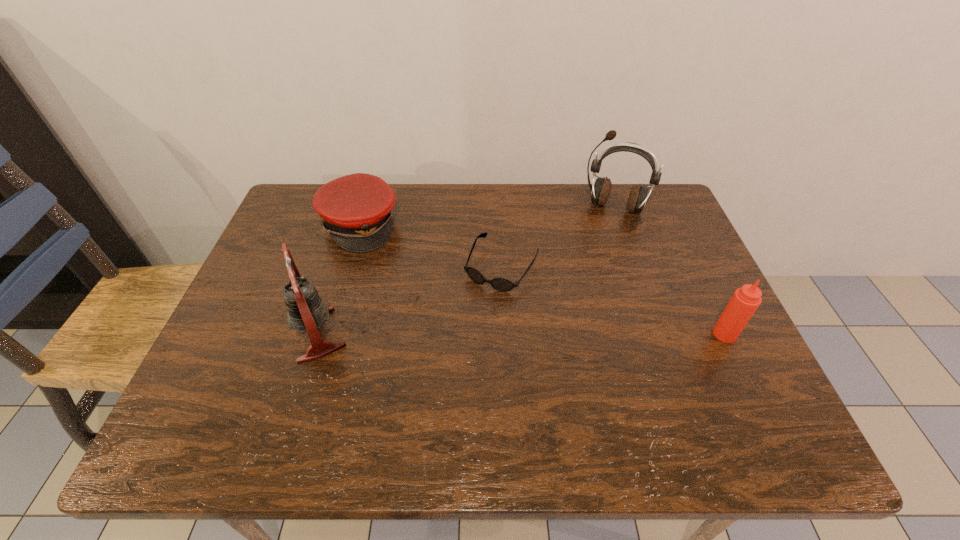
The height and width of the screenshot is (540, 960). Identify the location of bell present at the left edge. (306, 311).

The image size is (960, 540). In order to click on cap that is at the left edge in this screenshot , I will do `click(357, 209)`.

Locate an element on the screen. The width and height of the screenshot is (960, 540). Tabasco sauce present at the right edge is located at coordinates (745, 301).

You are a GUI agent. You are given a task and a screenshot of the screen. Output one action in this format:
    pyautogui.click(x=<x>, y=<y>)
    Task: Click on the earphone that is positioned at the right edge
    
    Given the screenshot: What is the action you would take?
    pyautogui.click(x=600, y=191)

Find the location of a particular element. The width and height of the screenshot is (960, 540). object located at the far left corner is located at coordinates (357, 209).

Identify the location of object that is at the far right corner. Image resolution: width=960 pixels, height=540 pixels. (600, 191).

This screenshot has width=960, height=540. In order to click on free space at the far edge in this screenshot , I will do `click(476, 219)`.

Where is `vacant space at the near edge`? Image resolution: width=960 pixels, height=540 pixels. vacant space at the near edge is located at coordinates (544, 376).

This screenshot has width=960, height=540. Find the location of `vacant space at the left edge of the desktop`. vacant space at the left edge of the desktop is located at coordinates (284, 274).

Where is `free region at the right edge`? The height and width of the screenshot is (540, 960). free region at the right edge is located at coordinates (711, 298).